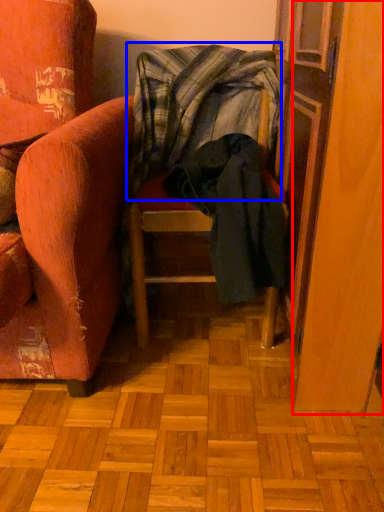
Question: Which of the following is the closest to the observer, screen door (highlighted by a red box) or blanket (highlighted by a blue box)?

Choices:
 (A) screen door
 (B) blanket

Answer: (A)